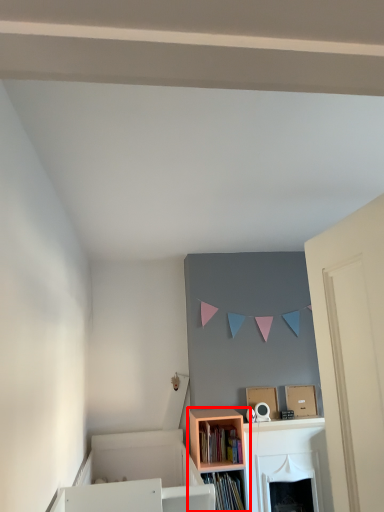
Question: Where is shelf (annotated by the red box) located in relation to book in the image?

Choices:
 (A) left
 (B) right

Answer: (B)